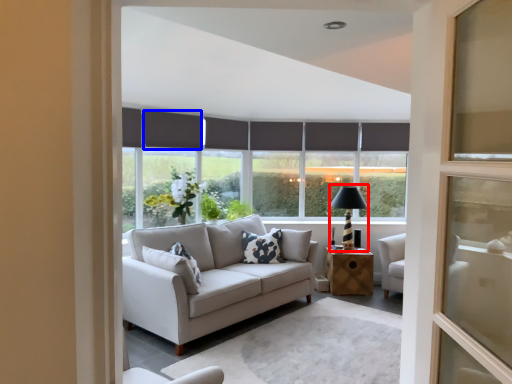
Question: Which object appears farthest to the camera in this image, table lamp (highlighted by a red box) or curtain (highlighted by a blue box)?

Choices:
 (A) table lamp
 (B) curtain

Answer: (A)